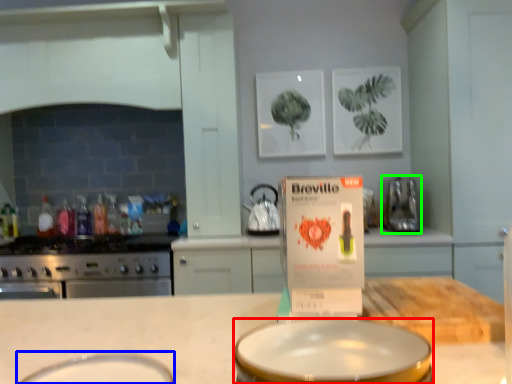
Question: Which object is the farthest from basin (highlighted by a red box)? Choose among these: basin (highlighted by a blue box) or kitchen appliance (highlighted by a green box).

Choices:
 (A) basin
 (B) kitchen appliance

Answer: (B)